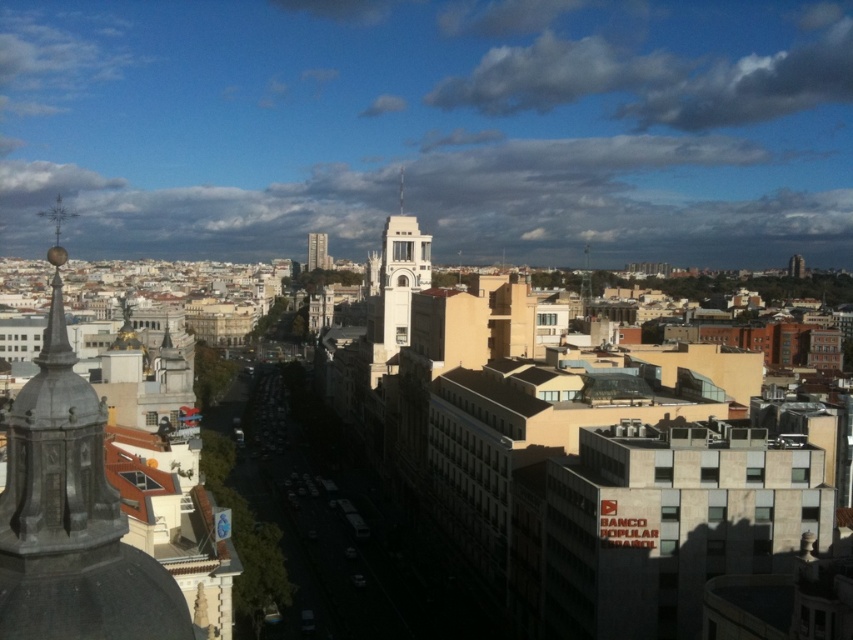
You are a city planner analyzing the skyline. You notice the white concrete tower at center and the smooth glass skyscraper at center. Which one occupies more space in the cityscape?

The white concrete tower at center is larger in size than the smooth glass skyscraper at center, so it occupies more space in the cityscape.

You are a drone operator tasked with flying a drone between the smooth glass skyscraper at center and the silver metallic spire at center. The drone has a maximum flight distance of 60 meters. Can the drone safely travel between these two structures without exceeding its range?

The distance between the smooth glass skyscraper at center and the silver metallic spire at center is 64.16 meters. Since the drone has a maximum flight distance of 60 meters, it cannot safely travel between them without exceeding its range.